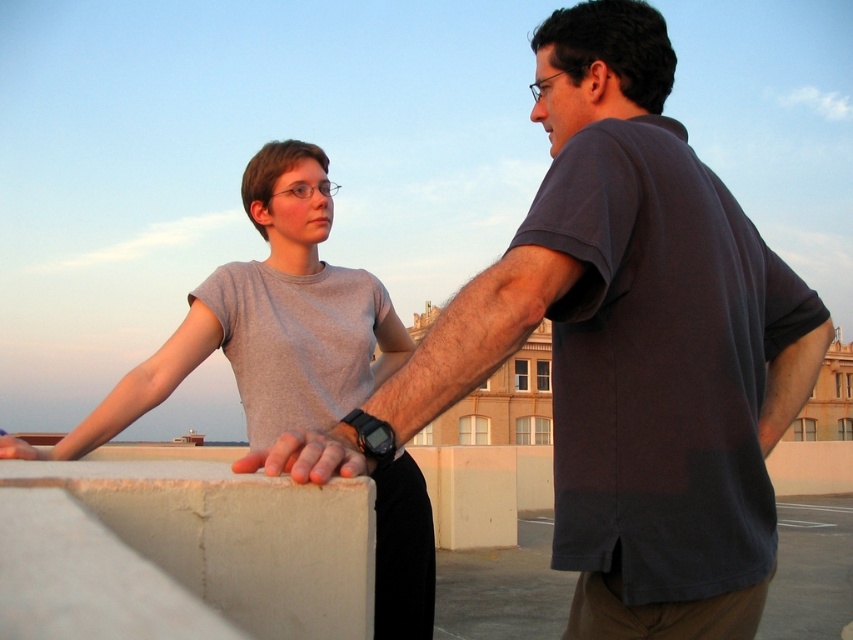
Question: Is matte gray t-shirt at upper left further to camera compared to smooth tan skin at center?

Choices:
 (A) no
 (B) yes

Answer: (A)

Question: Based on their relative distances, which object is farther from the smooth tan skin at center?

Choices:
 (A) dark gray t-shirt at center
 (B) matte gray t-shirt at upper left

Answer: (B)

Question: Which of the following is the closest to the observer?

Choices:
 (A) smooth tan skin at center
 (B) matte gray t-shirt at upper left
 (C) dark gray t-shirt at center

Answer: (B)

Question: Can you confirm if matte gray t-shirt at upper left is positioned to the left of smooth tan skin at center?

Choices:
 (A) no
 (B) yes

Answer: (B)

Question: Which point is farther from the camera taking this photo?

Choices:
 (A) (602, 124)
 (B) (410, 545)
 (C) (303, 481)

Answer: (B)

Question: Does matte gray t-shirt at upper left appear on the left side of smooth tan skin at center?

Choices:
 (A) no
 (B) yes

Answer: (B)